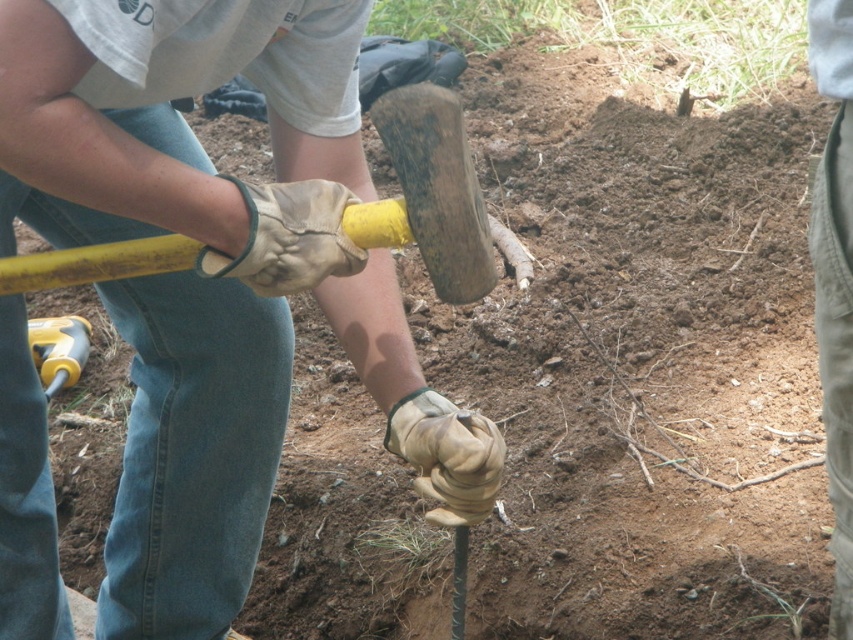
You are a safety inspector observing the worker using the wooden hammer at center and the yellow plastic handle at lower left. Which object is positioned closer to your viewpoint?

The wooden hammer at center is closer to the viewer than the yellow plastic handle at lower left.

You are standing 3 feet away from the wooden hammer at center and want to pick it up. Can you reach it without moving your feet?

The wooden hammer at center and camera are 3.81 feet apart, so you are 3 feet away from the wooden hammer at center. Since the distance is within your reach, you can pick it up without moving your feet.